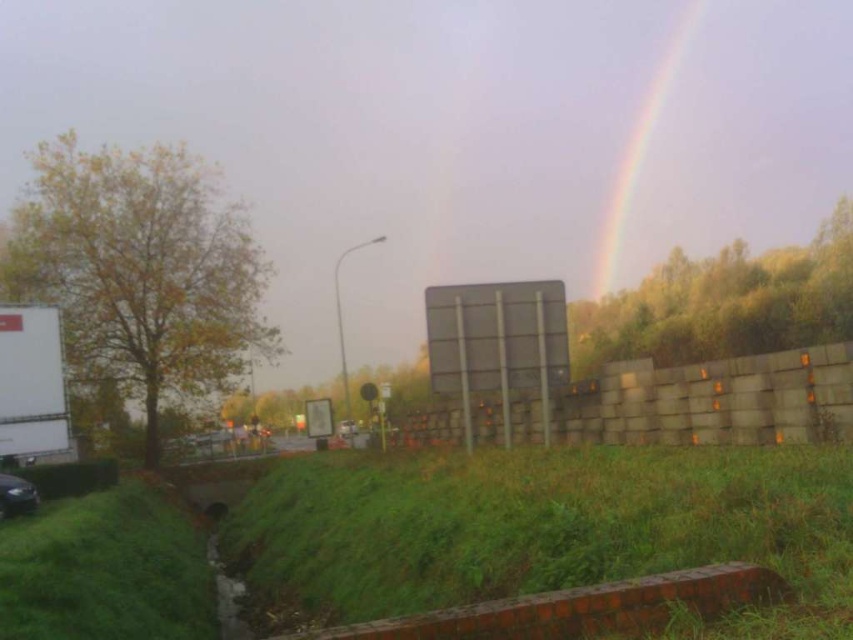
You are a delivery robot with a 2 meter wide package. You need to move from the shiny black car at lower left to the green grass at lower center. Can you pass through the space between them without moving the car?

The distance between the green grass at lower center and shiny black car at lower left is 8.84 meters. Since the package is 2 meters wide, there is sufficient space to pass through without moving the car.

Based on the photo, you are standing in the scene and want to walk from the green grass at lower left to the rainbow at upper right. Which direction should you move first?

You should move to the right first because the green grass at lower left is to the left of the rainbow at upper right, so moving right will bring you closer to the rainbow at upper right.